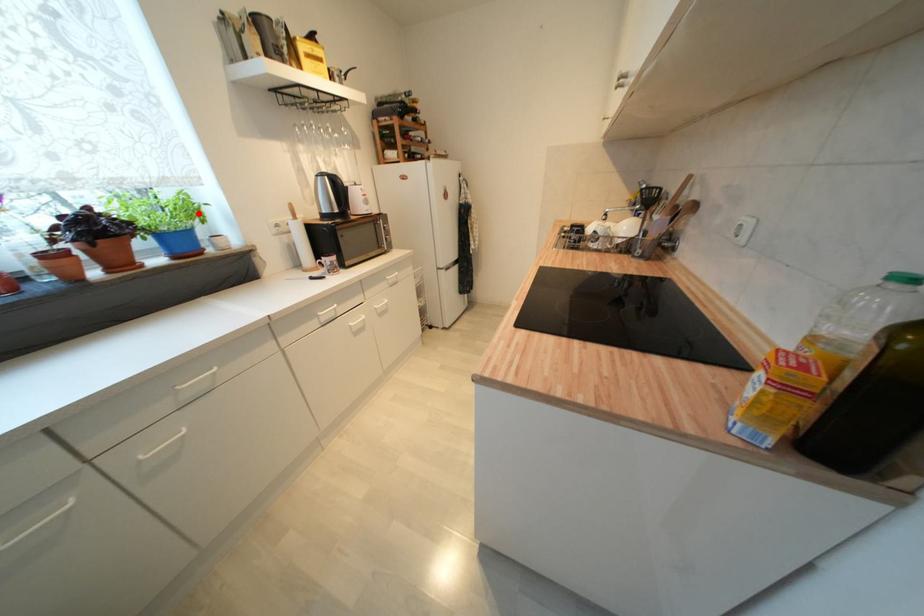
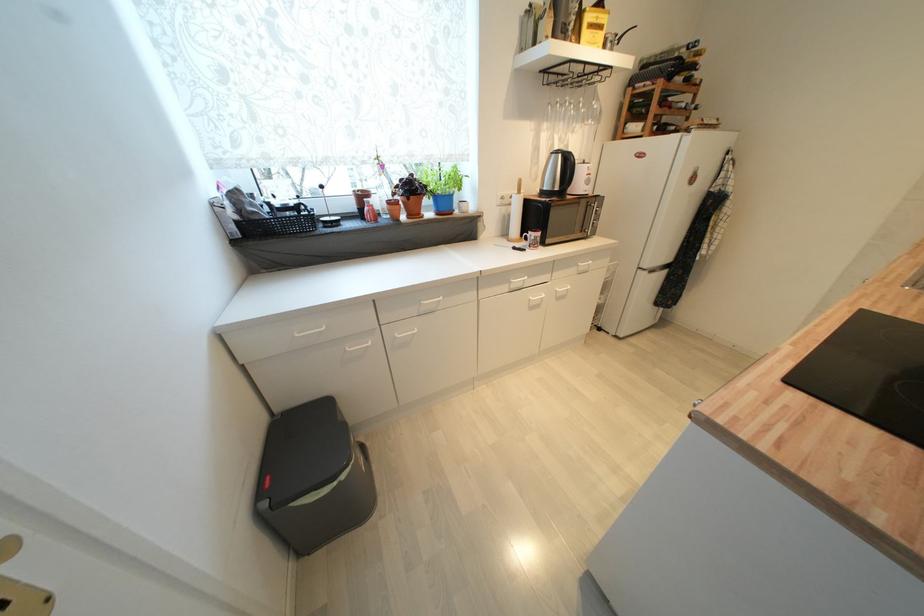
Question: I am providing you with two images of the same scene from different viewpoints. A red point is marked on the first image. At the location where the point appears in image 1, is it still visible in image 2?

Choices:
 (A) Yes
 (B) No

Answer: (A)